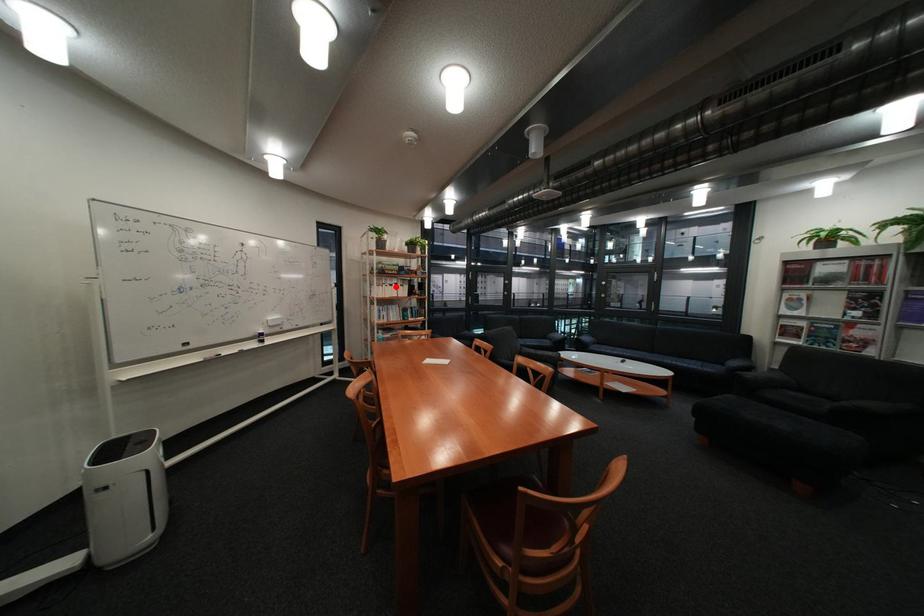
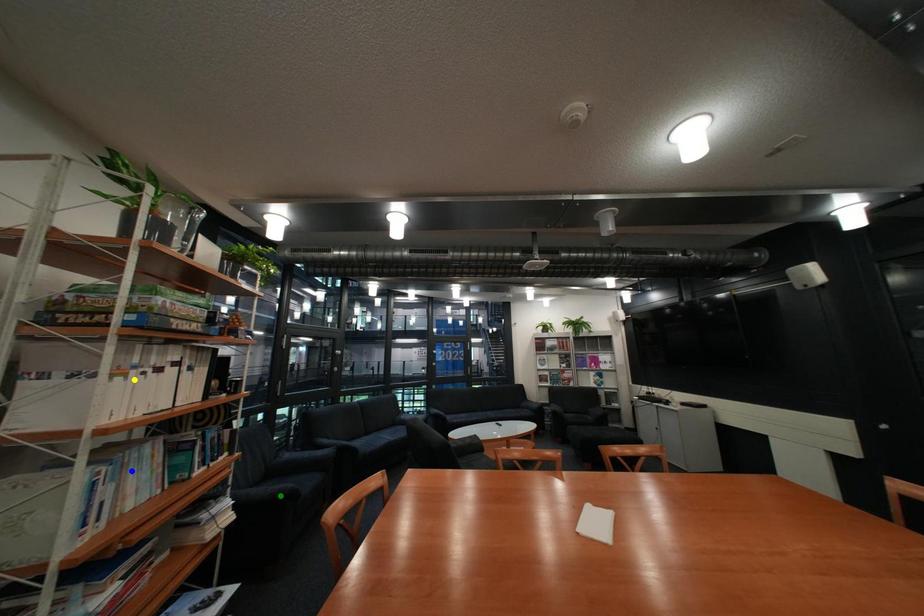
Question: I am providing you with two images of the same scene from different viewpoints. A red point is marked on the first image. You are given multiple points on the second image. Which spot in image 2 lines up with the point in image 1?

Choices:
 (A) yellow point
 (B) blue point
 (C) green point

Answer: (A)